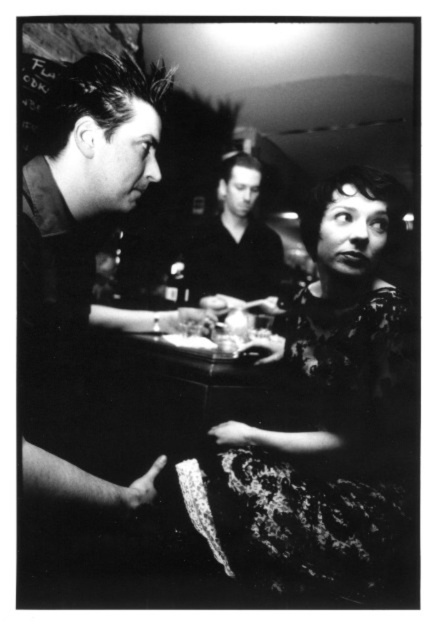
You are a photographer adjusting the focus of your camera. You want to capture both the smooth black shirt at center and the smooth plastic plate at center clearly. Given that your camera can only focus on objects within a 5 inch range, will both items be in focus?

The smooth black shirt at center is 4.76 inches from the smooth plastic plate at center. Since the distance between them is less than 5 inches, both items will be within the camera focus range and should appear clear in the photo.

You are a photographer analyzing this black and white image. You notice a point at coordinates (235, 241). Based on the scene description, what object in the image does this point most likely belong to?

The point at coordinates (235, 241) is on the smooth black shirt at center.